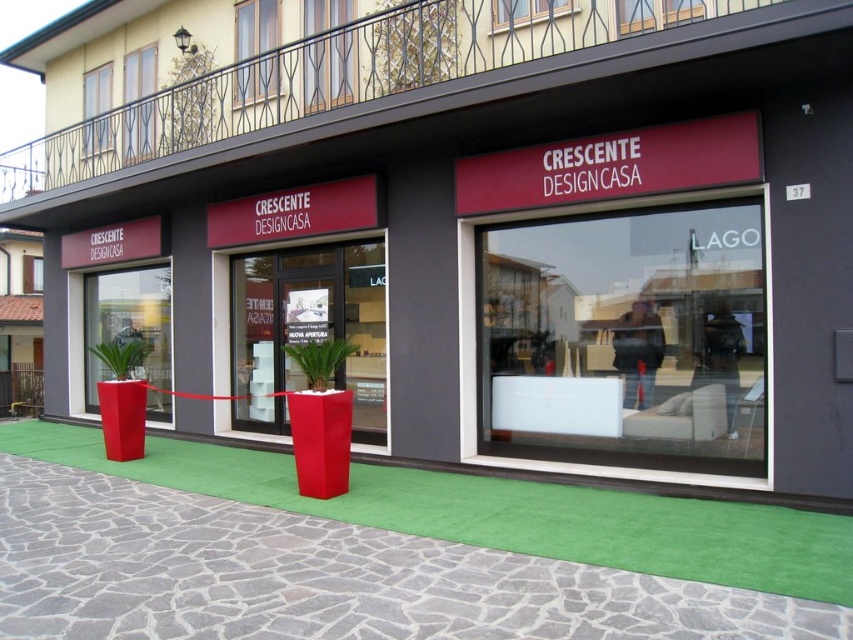
You are a delivery person standing at the entrance of the store. You need to place a package on the transparent glass window at center. Can you reach it without moving from your current position?

The transparent glass window at center is 6.28 meters away from the camera, so it is too far to reach without moving from your current position.

You are a delivery person trying to unload a heavy box from your truck. You need to place it on the green stone pavement at lower center. However, you notice the transparent glass window at center might be in the way. Based on their heights, can you safely place the box without hitting the window?

The green stone pavement at lower center has a lesser height compared to the transparent glass window at center. Since the pavement is lower, placing the box there won

You are a customer approaching the store entrance. You see the green stone pavement at lower center and the transparent glass window at center. Which object is closer to you as you approach the entrance?

The green stone pavement at lower center is closer to you as you approach the entrance because it is in front of the transparent glass window at center.